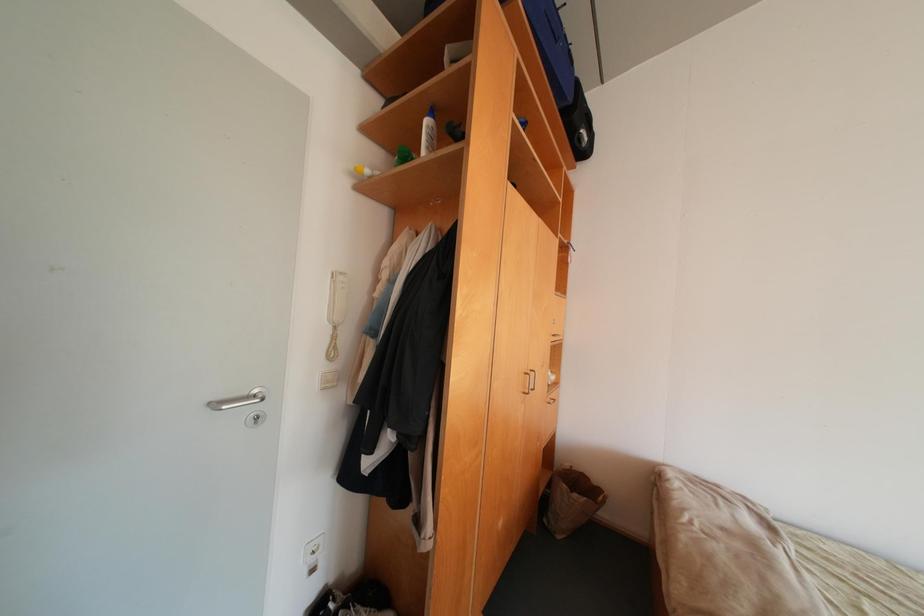
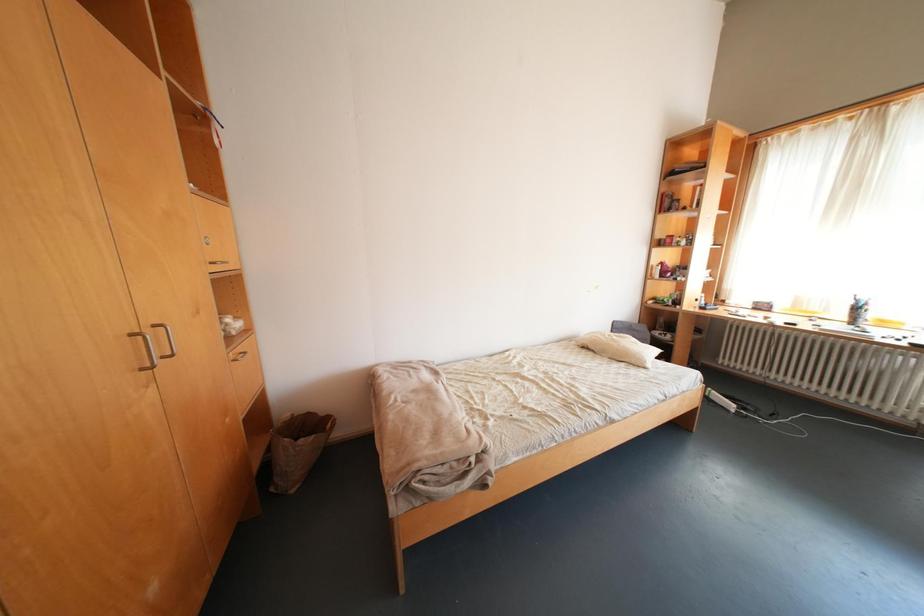
How did the camera likely rotate?

The camera rotated toward right-down.